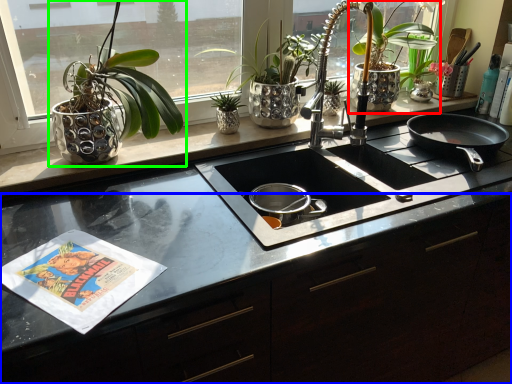
Question: Which is farther away from houseplant (highlighted by a red box)? counter (highlighted by a blue box) or houseplant (highlighted by a green box)?

Choices:
 (A) counter
 (B) houseplant

Answer: (B)